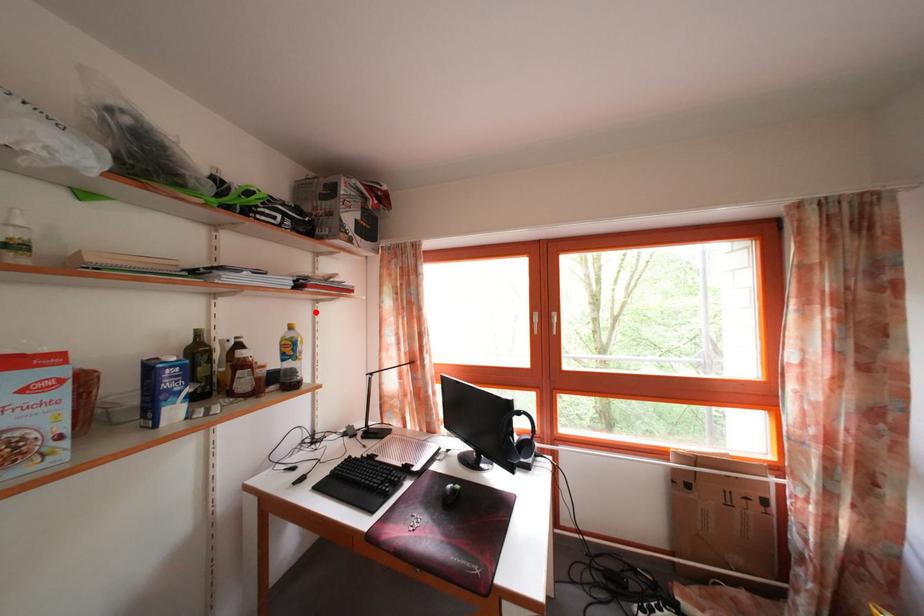
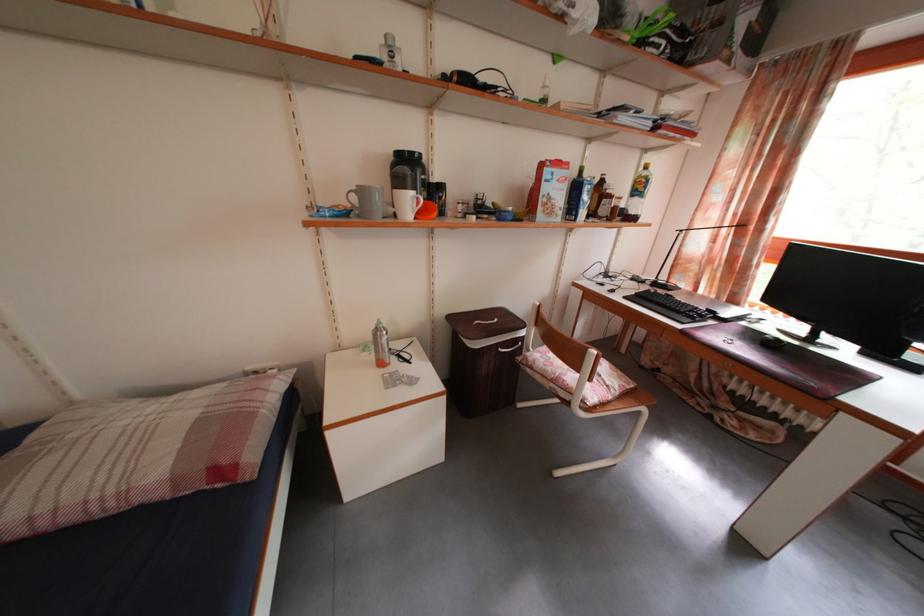
Question: I am providing you with two images of the same scene from different viewpoints. A red point is shown in image1. For the corresponding object point in image2, is it positioned nearer or farther from the camera?

Choices:
 (A) Nearer
 (B) Farther

Answer: (A)